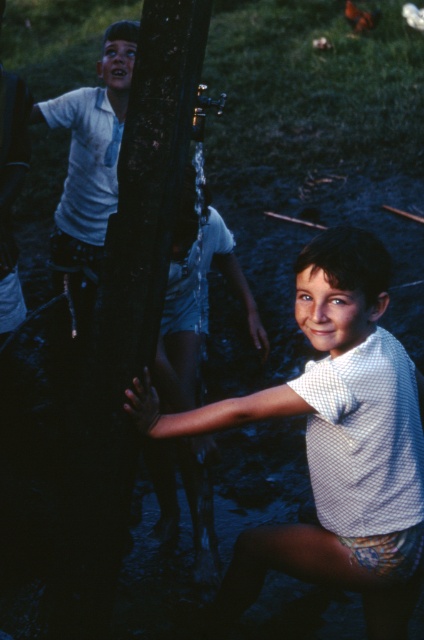
Question: Which point appears farthest from the camera in this image?

Choices:
 (A) (106, 64)
 (B) (225, 598)

Answer: (A)

Question: Can you confirm if white dotted shirt at center is positioned below white cotton shirt at upper left?

Choices:
 (A) no
 (B) yes

Answer: (B)

Question: Which point is closer to the camera?

Choices:
 (A) white dotted shirt at center
 (B) white cotton shirt at upper left

Answer: (A)

Question: From the image, what is the correct spatial relationship of white dotted shirt at center in relation to white cotton shirt at upper left?

Choices:
 (A) above
 (B) below

Answer: (B)

Question: Is white dotted shirt at center above white cotton shirt at upper left?

Choices:
 (A) yes
 (B) no

Answer: (B)

Question: Which object appears closest to the camera in this image?

Choices:
 (A) white dotted shirt at center
 (B) white cotton shirt at upper left

Answer: (A)